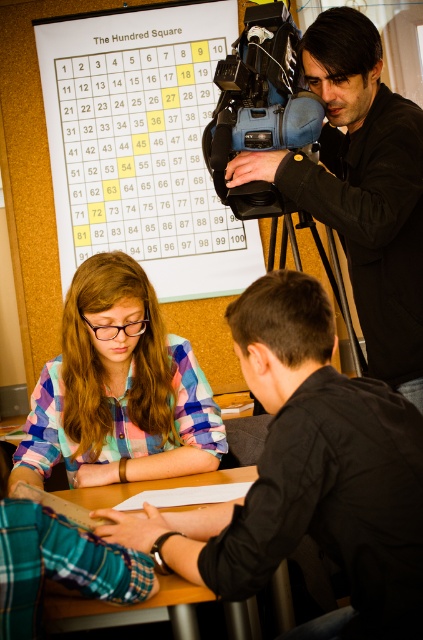
This screenshot has height=640, width=423. Describe the element at coordinates (142, 145) in the screenshot. I see `white paper at upper center` at that location.

This screenshot has width=423, height=640. What do you see at coordinates (142, 145) in the screenshot?
I see `white paper at upper center` at bounding box center [142, 145].

Find the location of `white paper at upper center`. white paper at upper center is located at coordinates (142, 145).

From the picture: Does black matte shirt at upper right appear over white paper at upper center?

No, black matte shirt at upper right is not above white paper at upper center.

Can you confirm if black matte shirt at upper right is wider than white paper at upper center?

No, black matte shirt at upper right is not wider than white paper at upper center.

Is point (115, 540) positioned after point (244, 284)?

No, (115, 540) is closer to viewer.

Identify the location of black matte shirt at upper right. The image size is (423, 640). (307, 472).

Does white paper at upper center have a greater width compared to wooden table at center?

Correct, the width of white paper at upper center exceeds that of wooden table at center.

Image resolution: width=423 pixels, height=640 pixels. Describe the element at coordinates (142, 145) in the screenshot. I see `white paper at upper center` at that location.

At what (x,y) coordinates should I click in order to perform the action: click on white paper at upper center. Please return your answer as a coordinate pair (x, y). Image resolution: width=423 pixels, height=640 pixels. Looking at the image, I should click on (142, 145).